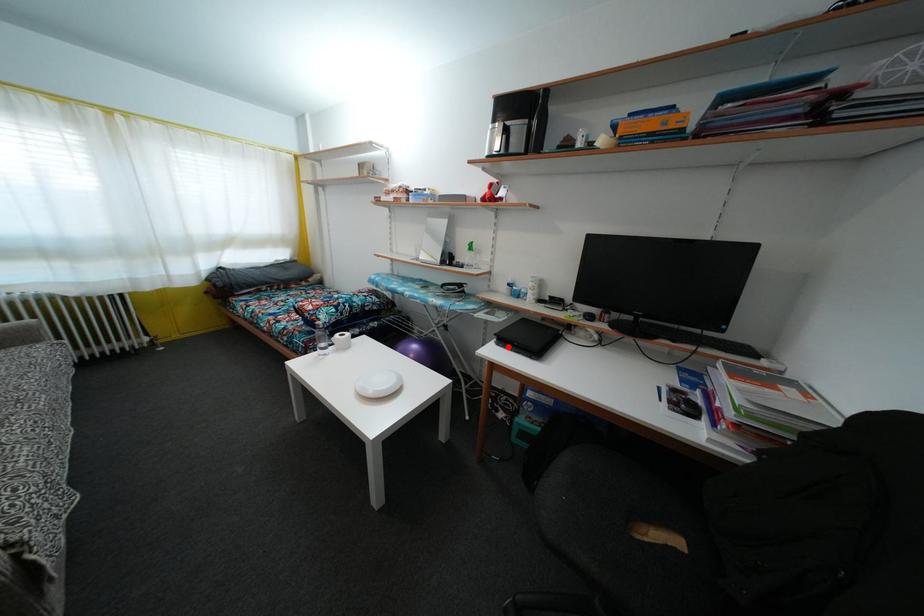
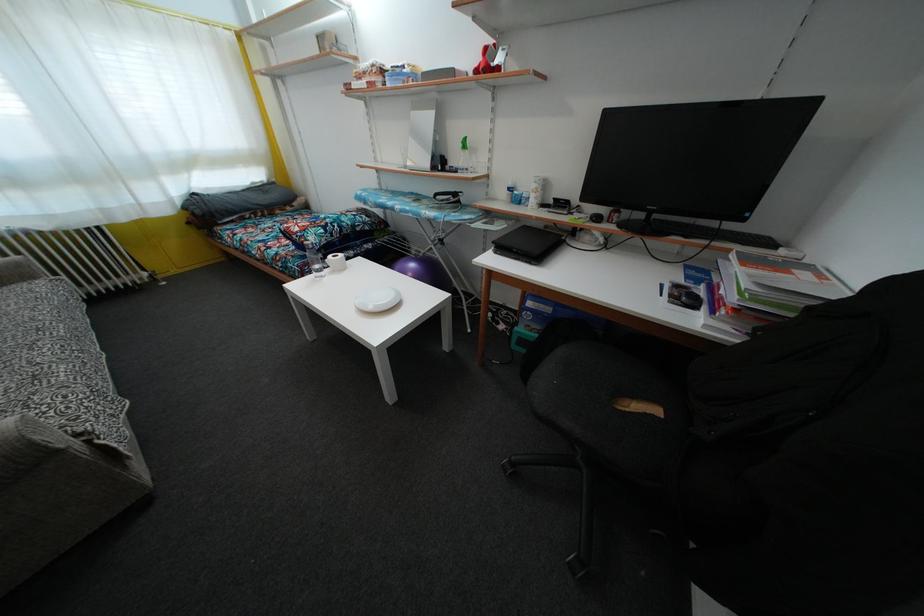
Locate, in the second image, the point that corresponds to the highlighted location in the first image.

(506, 254)